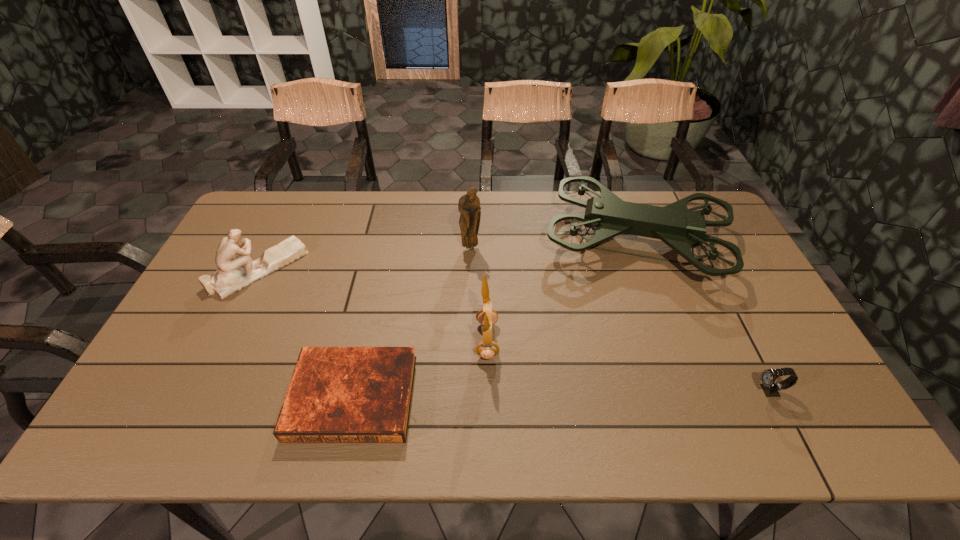
I want to click on the tallest object, so click(x=607, y=215).

Find the location of a particular element. This screenshot has height=540, width=960. the second tallest object is located at coordinates (469, 204).

This screenshot has height=540, width=960. What are the coordinates of `the taller figurine` in the screenshot? It's located at (469, 204).

Image resolution: width=960 pixels, height=540 pixels. What are the coordinates of `earphone` in the screenshot? It's located at (487, 349).

Where is `the shorter figurine`? The width and height of the screenshot is (960, 540). the shorter figurine is located at coordinates (236, 270).

The height and width of the screenshot is (540, 960). Find the location of `the fourth tallest object`. the fourth tallest object is located at coordinates (236, 270).

At what (x,y) coordinates should I click in order to perform the action: click on watch. Please return your answer as a coordinate pair (x, y). Looking at the image, I should click on (768, 377).

The width and height of the screenshot is (960, 540). What are the coordinates of `the second object from left to right` in the screenshot? It's located at (336, 394).

Find the location of a particular element. Image resolution: width=960 pixels, height=540 pixels. the shortest object is located at coordinates coord(336,394).

This screenshot has height=540, width=960. Find the location of `free spot located 0.360m on the left of the drone`. free spot located 0.360m on the left of the drone is located at coordinates (433, 241).